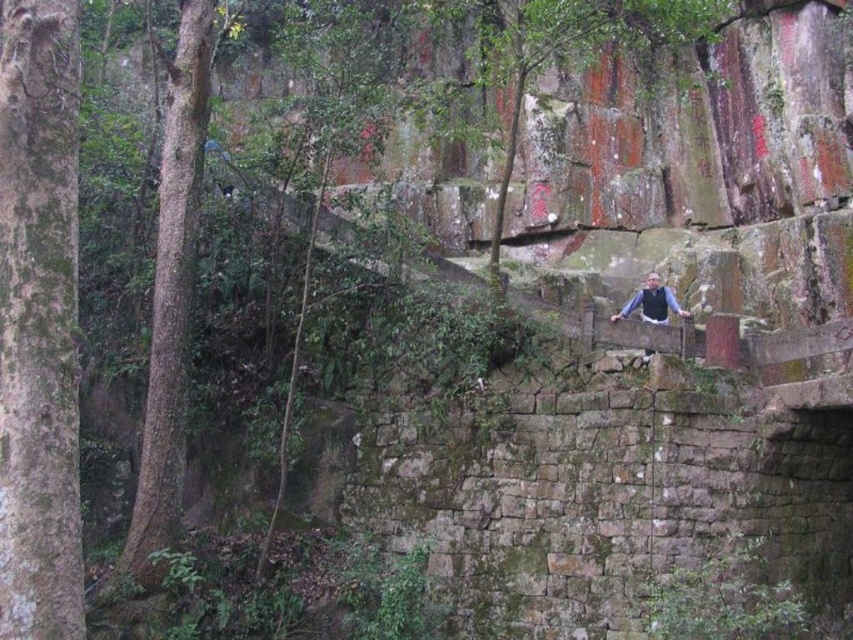
Question: Which of the following is the farthest from the observer?

Choices:
 (A) green mossy bark tree at left
 (B) green rough bark tree at left

Answer: (B)

Question: Which object appears farthest from the camera in this image?

Choices:
 (A) green rough bark tree at left
 (B) green mossy bark tree at left

Answer: (A)

Question: Which point appears closest to the camera in this image?

Choices:
 (A) (144, 404)
 (B) (68, 360)

Answer: (B)

Question: Is green mossy bark tree at left below green rough bark tree at left?

Choices:
 (A) yes
 (B) no

Answer: (A)

Question: Is green mossy bark tree at left in front of green rough bark tree at left?

Choices:
 (A) no
 (B) yes

Answer: (B)

Question: In this image, where is green mossy bark tree at left located relative to green rough bark tree at left?

Choices:
 (A) below
 (B) above

Answer: (A)